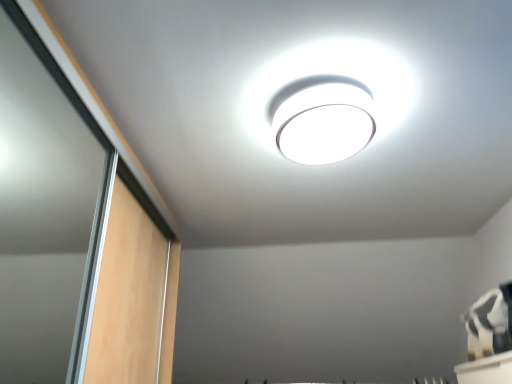
At what (x,y) coordinates should I click in order to perform the action: click on white glossy lamp at upper center. Please return your answer as a coordinate pair (x, y). This screenshot has height=384, width=512. Looking at the image, I should click on (329, 101).

Consider the image. Measure the distance between point (343, 117) and camera.

They are 1.16 meters apart.

What do you see at coordinates (329, 101) in the screenshot? The width and height of the screenshot is (512, 384). I see `white glossy lamp at upper center` at bounding box center [329, 101].

Find the location of a particular element. white glossy lamp at upper center is located at coordinates (329, 101).